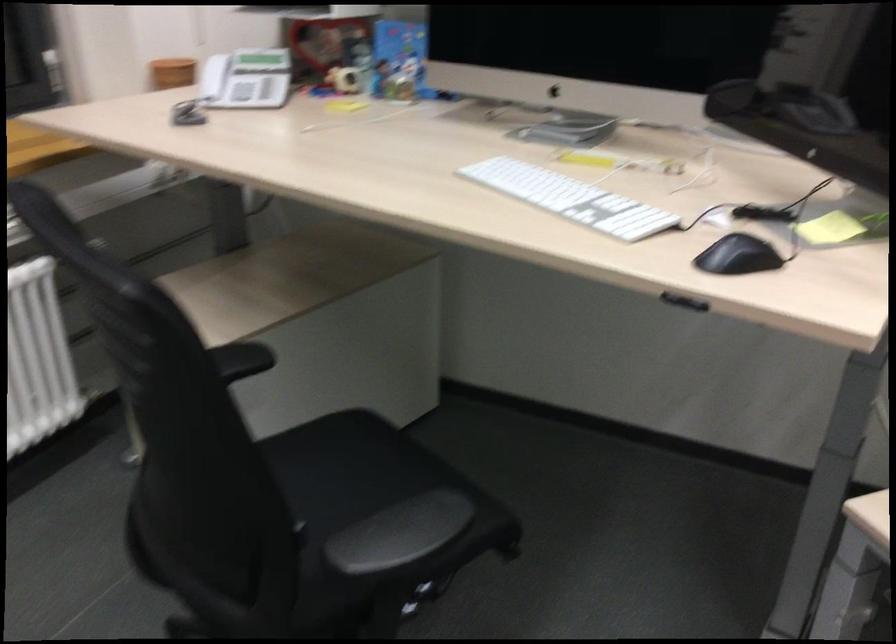
What do you see at coordinates (400, 534) in the screenshot? I see `the chair armrest` at bounding box center [400, 534].